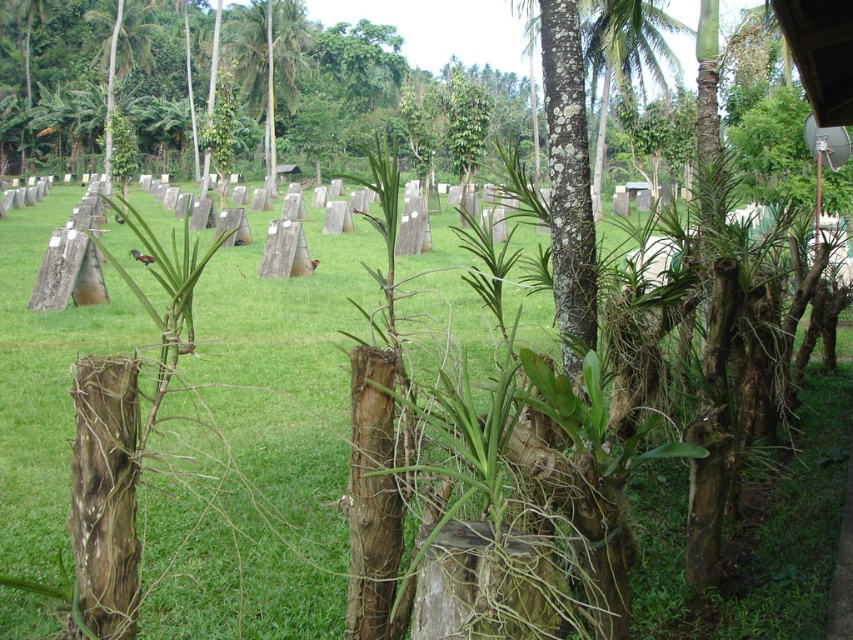
Question: Which object is the closest to the green leafy palm tree at center?

Choices:
 (A) green grass at center
 (B) green leafy palm tree at upper left

Answer: (B)

Question: Does green leafy palm tree at center appear over green leafy palm tree at upper left?

Choices:
 (A) no
 (B) yes

Answer: (B)

Question: Which of the following is the closest to the observer?

Choices:
 (A) (62, 461)
 (B) (111, 131)
 (C) (274, 83)

Answer: (A)

Question: Does green grass at center come in front of green leafy palm tree at center?

Choices:
 (A) yes
 (B) no

Answer: (A)

Question: Which of these objects is positioned farthest from the green grass at center?

Choices:
 (A) green leafy palm tree at center
 (B) green leafy palm tree at upper left

Answer: (A)

Question: Is green grass at center further to the viewer compared to green leafy palm tree at center?

Choices:
 (A) no
 (B) yes

Answer: (A)